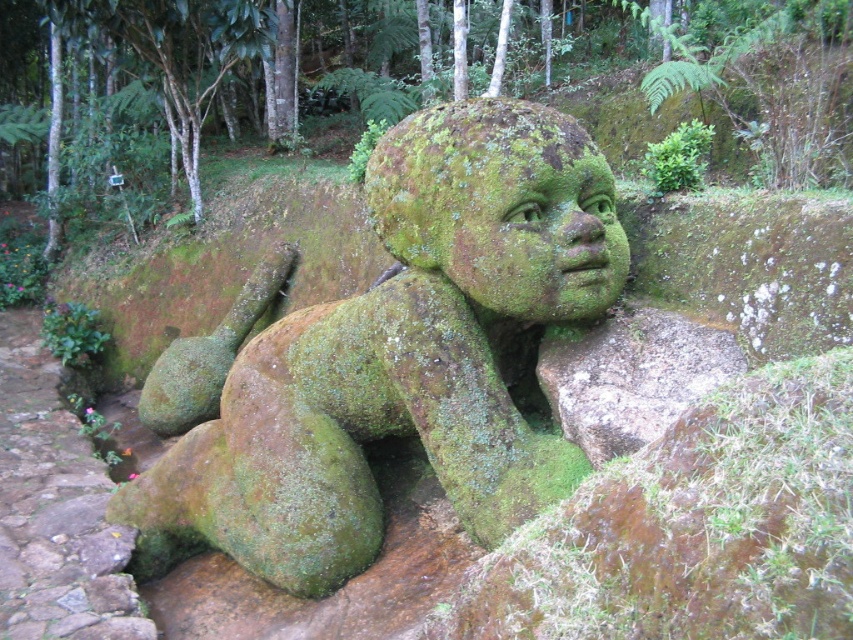
You are an archaeologist examining the forest area. You notice the green mossy statue at center and the green mossy rock at lower center. Based on their positions, which object is closer to you?

The green mossy statue at center is closer to you because the green mossy rock at lower center is behind it.

You are a hiker who wants to take a photo of the green mossy statue at center and the green mossy rock at lower center. Since you want both objects to be clearly visible in the frame, which object should you focus on first to ensure proper focus?

You should focus on the green mossy statue at center first because it is taller than the green mossy rock at lower center, so it will require more precise focus to capture its details.

You are an artist examining the sculpture in the forest. You notice a specific point marked at coordinates (502,205) on the sculpture. Based on the sculpture description, which part of the sculpture does this point most likely represent?

The point at coordinates (502,205) corresponds to the green mossy head at center.